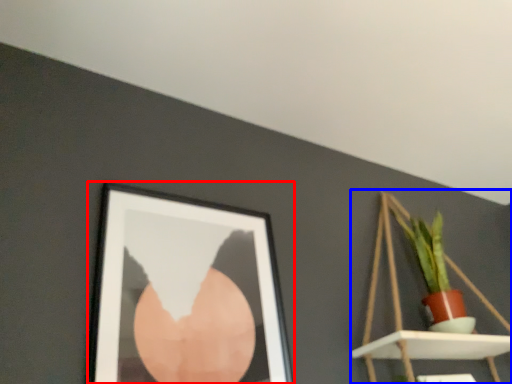
Question: Which object appears farthest to the camera in this image, picture frame (highlighted by a red box) or shelf (highlighted by a blue box)?

Choices:
 (A) picture frame
 (B) shelf

Answer: (B)